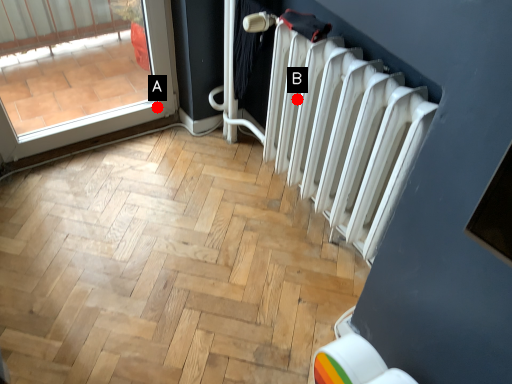
Question: Two points are circled on the image, labeled by A and B beside each circle. Which point is farther to the camera?

Choices:
 (A) A is further
 (B) B is further

Answer: (A)